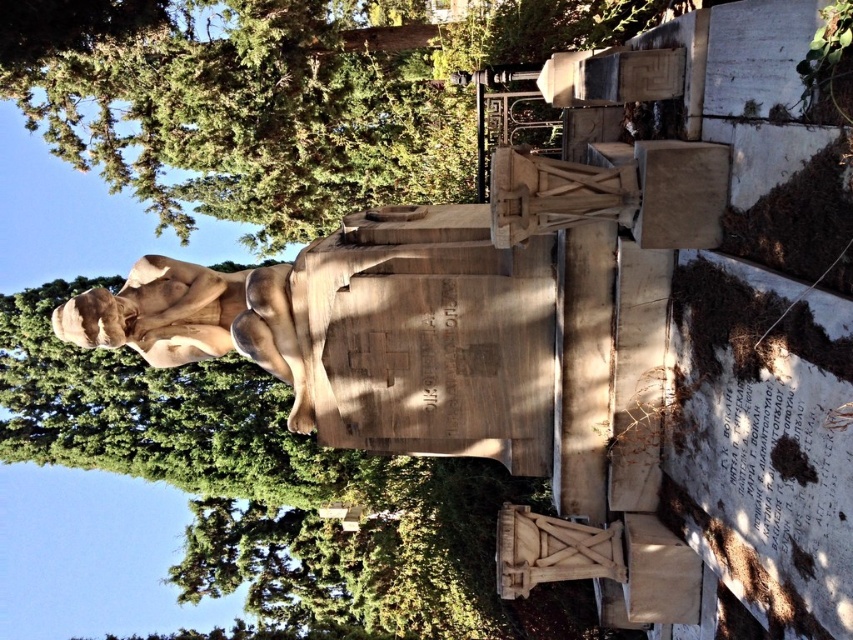
Question: Can you confirm if green leafy tree at upper left is bigger than matte stone statue at center?

Choices:
 (A) yes
 (B) no

Answer: (B)

Question: Among these objects, which one is farthest from the camera?

Choices:
 (A) green leafy tree at upper left
 (B) matte stone statue at center

Answer: (A)

Question: Which object appears closest to the camera in this image?

Choices:
 (A) green leafy tree at upper left
 (B) matte stone statue at center

Answer: (B)

Question: Does green leafy tree at upper left appear on the right side of matte stone statue at center?

Choices:
 (A) yes
 (B) no

Answer: (A)

Question: Is green leafy tree at upper left positioned at the back of matte stone statue at center?

Choices:
 (A) yes
 (B) no

Answer: (A)